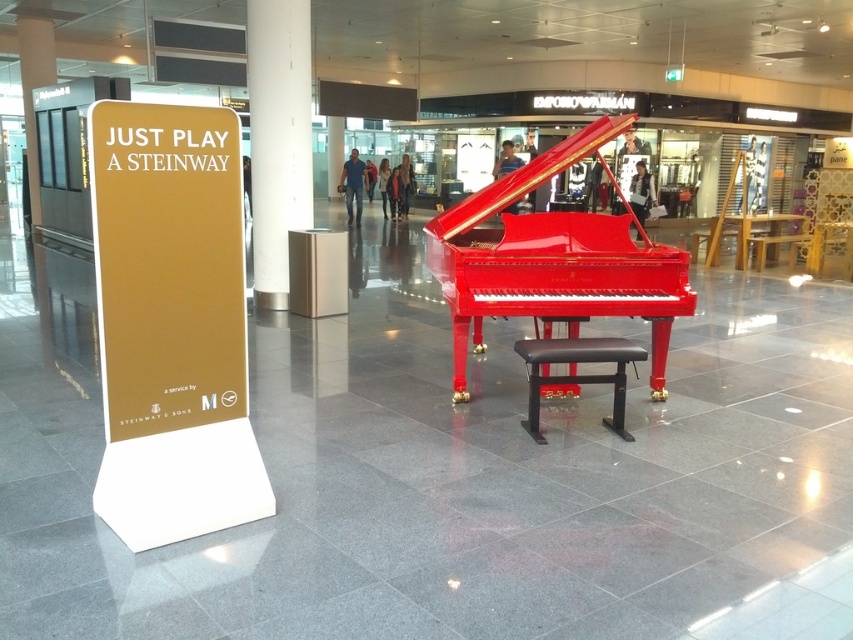
You are an architect reviewing the structural integrity of the pillars in the mall atrium. The white glossy pillar at center and the metallic gray pillar at center are both supporting the roof. Which pillar is taller and therefore might bear more weight?

The white glossy pillar at center has a greater height compared to the metallic gray pillar at center, so it might bear more weight.

You are a performer preparing to play the piano. You need to adjust your position so that the black leather stool at center is between you and the metallic gray pillar at center. Is this possible given their current positions?

The black leather stool at center is already positioned below the metallic gray pillar at center, so moving it to be between you and the pillar would require placing it in front of the pillar. Since the stool is currently below the pillar, it can be moved into a position where it is between you and the pillar if you are standing in front of the stool.